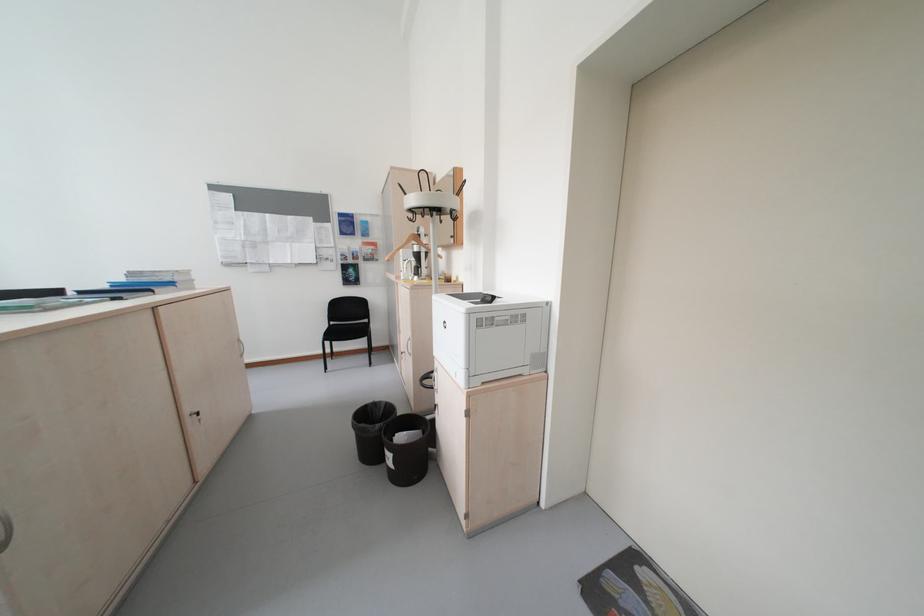
What do you see at coordinates (346, 331) in the screenshot?
I see `the chair sitting surface` at bounding box center [346, 331].